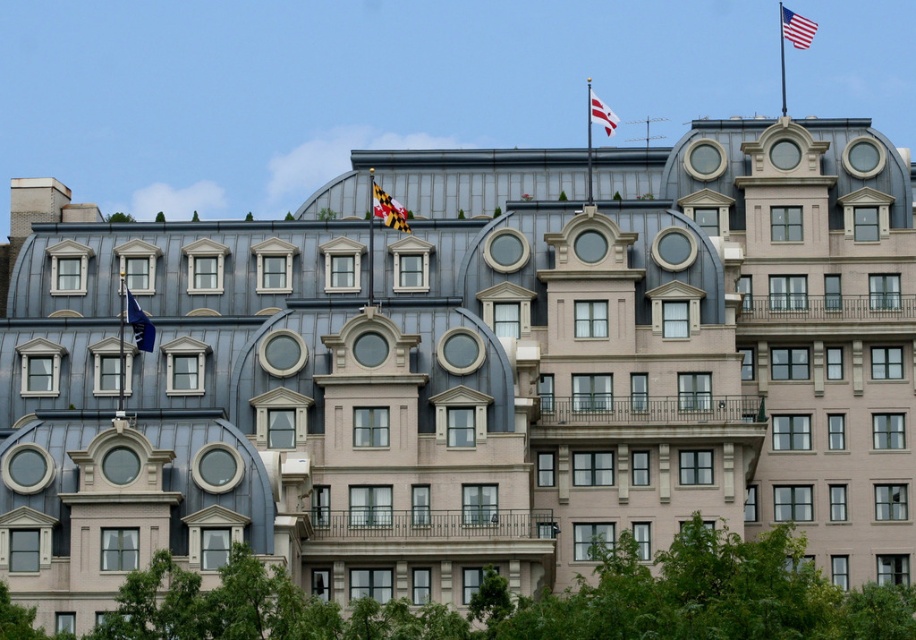
Question: Is maryland state flag at center closer to the viewer compared to blue fabric flag at left?

Choices:
 (A) yes
 (B) no

Answer: (B)

Question: Which of the following is the farthest from the observer?

Choices:
 (A) blue fabric flag at left
 (B) maryland state flag at center

Answer: (B)

Question: Which point appears closest to the camera in this image?

Choices:
 (A) (781, 26)
 (B) (149, 344)
 (C) (598, 124)
 (D) (389, 225)

Answer: (B)

Question: Observing the image, what is the correct spatial positioning of maryland state flag at center in reference to blue fabric flag at left?

Choices:
 (A) left
 (B) right

Answer: (B)

Question: Is maryland state flag at center wider than blue fabric flag at left?

Choices:
 (A) yes
 (B) no

Answer: (A)

Question: Based on their relative distances, which object is nearer to the blue fabric flag at left?

Choices:
 (A) american flag at upper right
 (B) maryland state flag at center
 (C) white fabric flag at upper center

Answer: (B)